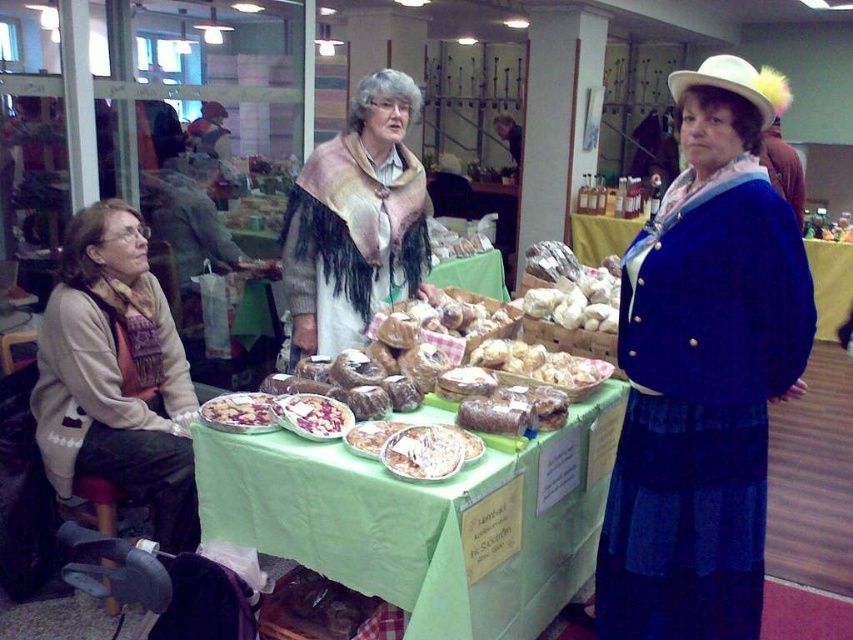
Which is behind, point (715, 602) or point (318, 438)?

Positioned behind is point (715, 602).

Is velvet blue coat at right to the left of white glossy sliced potatoes at center from the viewer's perspective?

In fact, velvet blue coat at right is to the right of white glossy sliced potatoes at center.

What do you see at coordinates (703, 372) in the screenshot?
I see `velvet blue coat at right` at bounding box center [703, 372].

The height and width of the screenshot is (640, 853). In order to click on velvet blue coat at right in this screenshot , I will do `click(703, 372)`.

Which is more to the right, beige fringed shawl at center or white glossy sliced potatoes at center?

Positioned to the right is beige fringed shawl at center.

Between point (281, 276) and point (285, 426), which one is positioned behind?

Point (281, 276)

You are a GUI agent. You are given a task and a screenshot of the screen. Output one action in this format:
    pyautogui.click(x=<x>, y=<y>)
    Task: Click on the beige fringed shawl at center
    The height and width of the screenshot is (640, 853).
    Given the screenshot: What is the action you would take?
    pyautogui.click(x=357, y=221)

Where is `beige fringed shawl at center`? The height and width of the screenshot is (640, 853). beige fringed shawl at center is located at coordinates (357, 221).

Can you confirm if velvet blue coat at right is smaller than bread at center?

No.

Can you confirm if velvet blue coat at right is positioned to the right of bread at center?

Correct, you'll find velvet blue coat at right to the right of bread at center.

Which is behind, point (647, 536) or point (595, 268)?

Positioned behind is point (595, 268).

Where is `velvet blue coat at right`? This screenshot has width=853, height=640. velvet blue coat at right is located at coordinates (703, 372).